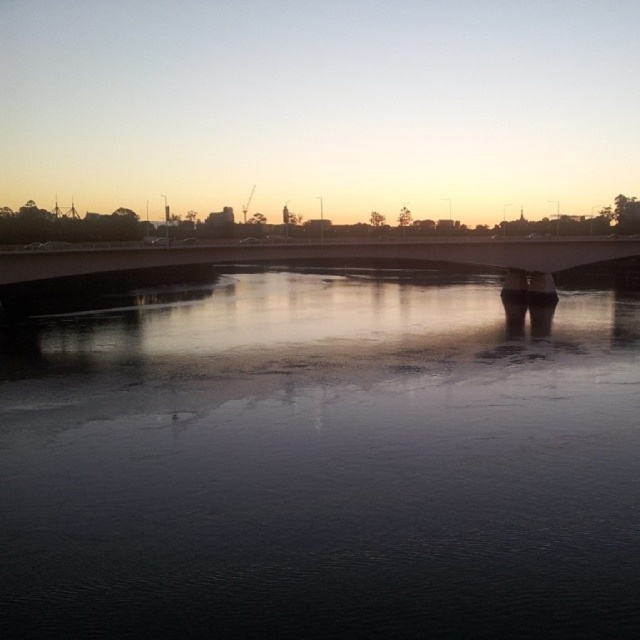
You are standing on the bridge and looking at two points in the scene. The first point is at coordinate point (188, 636) and the second point is at coordinate point (220, 243). Which point is closer to you?

Point (188, 636) is closer to the camera than point (220, 243), so the first point is closer to you.

You are standing at the edge of the dark reflective water at center and want to retrieve a floating object that is exactly 40 feet away from you. Can you reach it without entering the water?

The dark reflective water at center is 42.79 feet away from the viewer. Since the object is 40 feet away, it is within reach without entering the water.